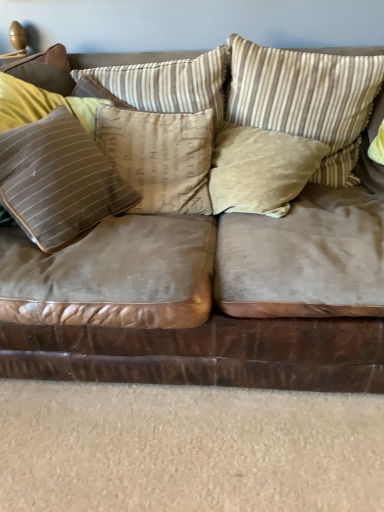
Question: From a real-world perspective, is suede-like brown pillow at left, which appears as the fifth pillow when viewed from the right, positioned under brown suede couch at center based on gravity?

Choices:
 (A) yes
 (B) no

Answer: (B)

Question: Is suede-like brown pillow at left, which ranks as the first pillow in left-to-right order, bigger than brown suede couch at center?

Choices:
 (A) no
 (B) yes

Answer: (A)

Question: Considering the relative positions of suede-like brown pillow at left, which appears as the fifth pillow when viewed from the right, and brown suede couch at center in the image provided, is suede-like brown pillow at left, which appears as the fifth pillow when viewed from the right, to the left of brown suede couch at center from the viewer's perspective?

Choices:
 (A) yes
 (B) no

Answer: (A)

Question: Considering the relative sizes of suede-like brown pillow at left, which ranks as the first pillow in left-to-right order, and brown suede couch at center in the image provided, is suede-like brown pillow at left, which ranks as the first pillow in left-to-right order, wider than brown suede couch at center?

Choices:
 (A) no
 (B) yes

Answer: (A)

Question: Can you confirm if suede-like brown pillow at left, which appears as the fifth pillow when viewed from the right, is smaller than brown suede couch at center?

Choices:
 (A) no
 (B) yes

Answer: (B)

Question: Is point (6, 286) closer or farther from the camera than point (137, 96)?

Choices:
 (A) closer
 (B) farther

Answer: (A)

Question: From the image's perspective, is brown suede couch at center located above or below brown striped pillow at center, the fourth pillow viewed from the right?

Choices:
 (A) above
 (B) below

Answer: (B)

Question: Looking at the image, does brown suede couch at center seem bigger or smaller compared to brown striped pillow at center, the second pillow viewed from the left?

Choices:
 (A) small
 (B) big

Answer: (B)

Question: Looking at their shapes, would you say brown suede couch at center is wider or thinner than brown striped pillow at center, the second pillow viewed from the left?

Choices:
 (A) wide
 (B) thin

Answer: (A)

Question: Does point (140, 170) appear closer or farther from the camera than point (292, 284)?

Choices:
 (A) farther
 (B) closer

Answer: (A)

Question: Do you think brown striped cushion at center, the 3th pillow positioned from the left, is within brown suede couch at center, or outside of it?

Choices:
 (A) outside
 (B) inside

Answer: (B)

Question: From the image's perspective, relative to brown suede couch at center, is brown striped cushion at center, the 3th pillow positioned from the left, above or below?

Choices:
 (A) below
 (B) above

Answer: (B)

Question: In terms of height, does brown striped cushion at center, the 3th pillow positioned from the left, look taller or shorter compared to brown suede couch at center?

Choices:
 (A) tall
 (B) short

Answer: (B)

Question: From a real-world perspective, relative to brown striped cushion at center, which is the 3th pillow from right to left, is brown suede couch at center vertically above or below?

Choices:
 (A) above
 (B) below

Answer: (B)

Question: In terms of size, does brown suede couch at center appear bigger or smaller than brown striped cushion at center, which is the 3th pillow from right to left?

Choices:
 (A) big
 (B) small

Answer: (A)